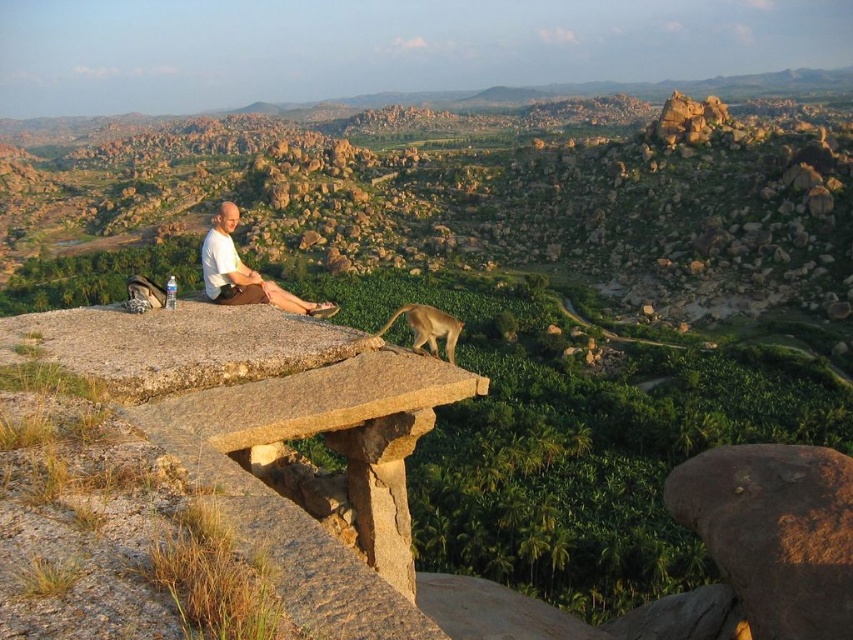
You are standing at point (421, 308) and want to walk to point (221, 202). Which direction should you move in relative to the rocky outcrop?

You should move forward towards the rocky outcrop because point (221, 202) is behind point (421, 308), meaning it is closer to the outcrop.

You are standing at the edge of the rocky outcrop where the man is sitting and want to pick up the brown rough stone at lower right. Considering your arm length is 0.7 meters, can you reach it without moving from your current position?

The brown rough stone at lower right is 15.38 meters away from the viewer. Since your arm length is only 0.7 meters, you cannot reach it without moving from your current position.

Based on the photo, you are planning to place a small statue on the brown rough stone at lower right or the golden fur monkey at center. Which surface can better support the statue in terms of height?

The brown rough stone at lower right has a greater height compared to the golden fur monkey at center, so it can better support the statue in terms of height.